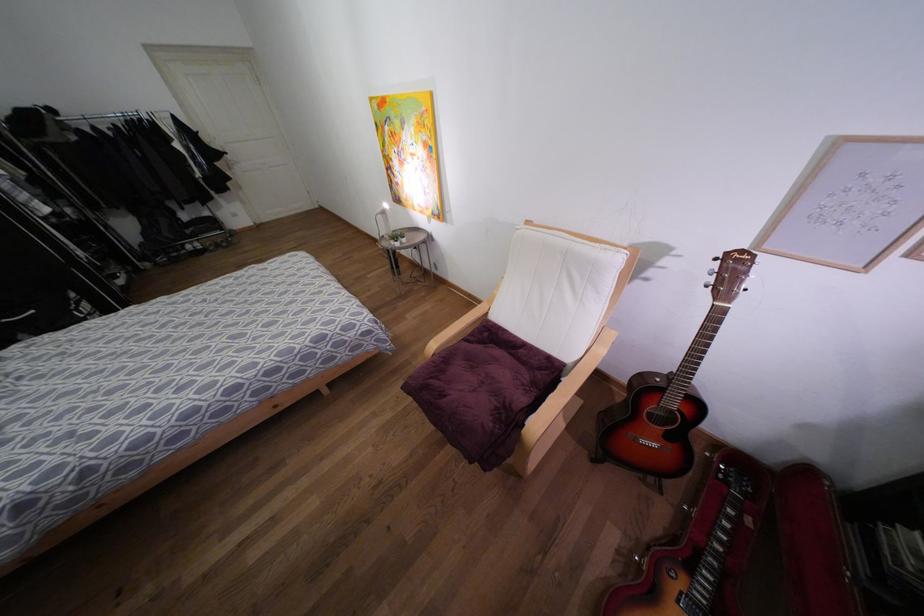
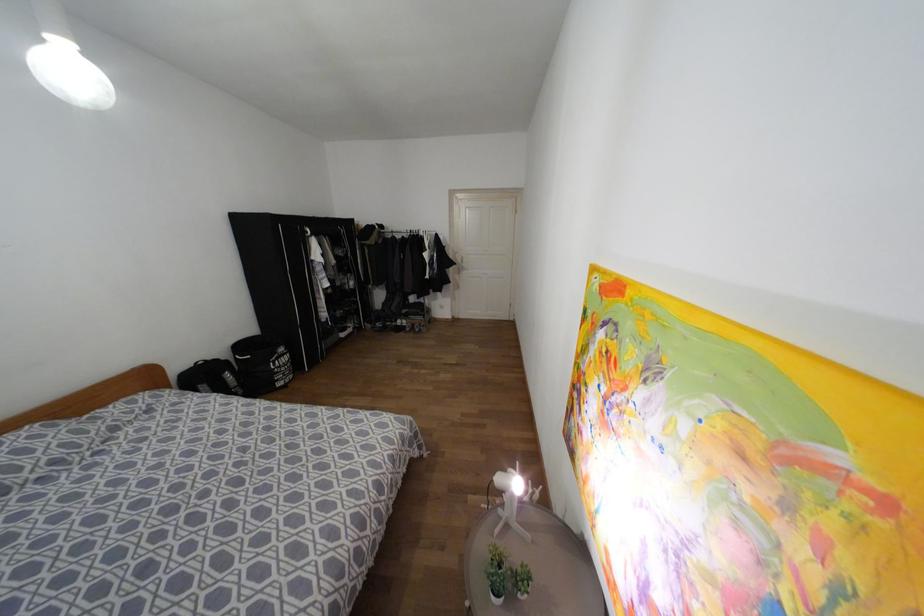
Question: I am providing you with two images of the same scene from different viewpoints. Which of the following objects are not visible in image2?

Choices:
 (A) small potted plant
 (B) black laundry bag
 (C) white door handle
 (D) none of these

Answer: (D)